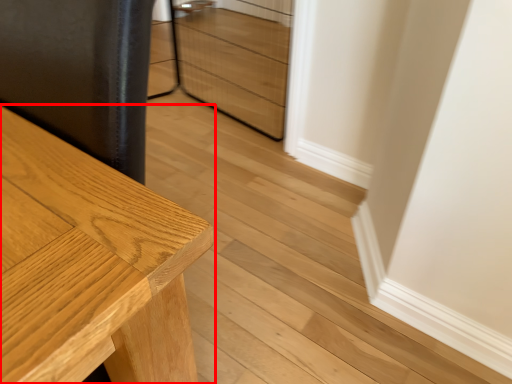
Question: From the image's perspective, where is table (annotated by the red box) located relative to drawer?

Choices:
 (A) below
 (B) above

Answer: (A)